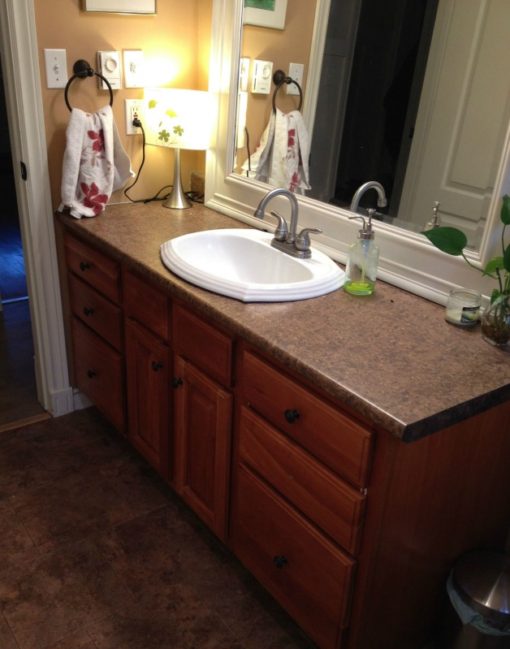
What are the coordinates of `lamp` in the screenshot? It's located at (192, 130).